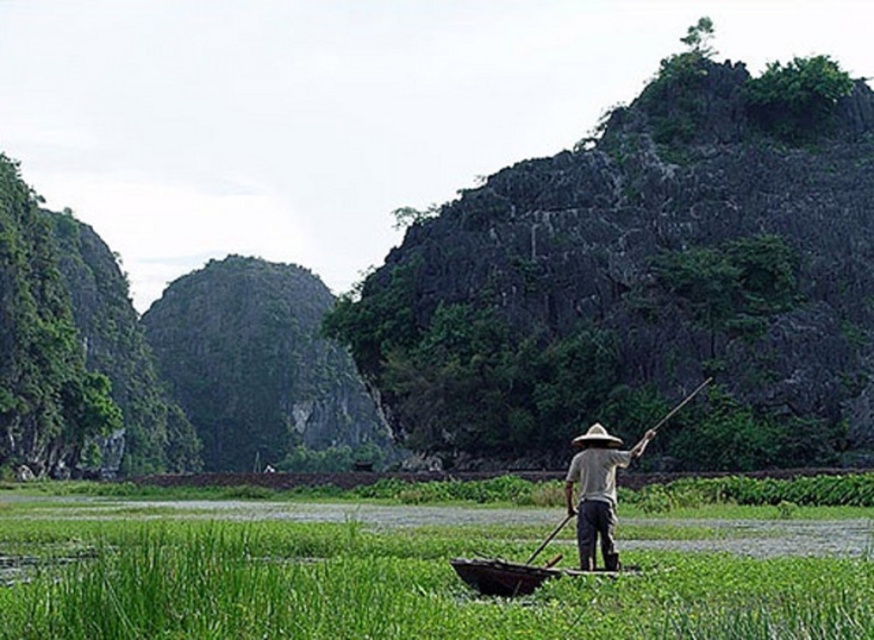
Question: Can you confirm if light brown straw hat at center is wider than brown straw hat at center?

Choices:
 (A) yes
 (B) no

Answer: (A)

Question: Does green grass at lower center have a lesser width compared to light brown straw hat at center?

Choices:
 (A) no
 (B) yes

Answer: (A)

Question: Which object appears closest to the camera in this image?

Choices:
 (A) wooden canoe at center
 (B) brown straw hat at center
 (C) light brown straw hat at center
 (D) green grass at lower center

Answer: (D)

Question: Estimate the real-world distances between objects in this image. Which object is farther from the brown straw hat at center?

Choices:
 (A) light brown straw hat at center
 (B) green leafy vegetation at upper center
 (C) wooden canoe at center
 (D) green grass at lower center

Answer: (B)

Question: Which object appears farthest from the camera in this image?

Choices:
 (A) green leafy vegetation at upper center
 (B) light brown straw hat at center
 (C) wooden canoe at center
 (D) brown straw hat at center

Answer: (A)

Question: Is green leafy vegetation at upper center smaller than light brown straw hat at center?

Choices:
 (A) yes
 (B) no

Answer: (B)